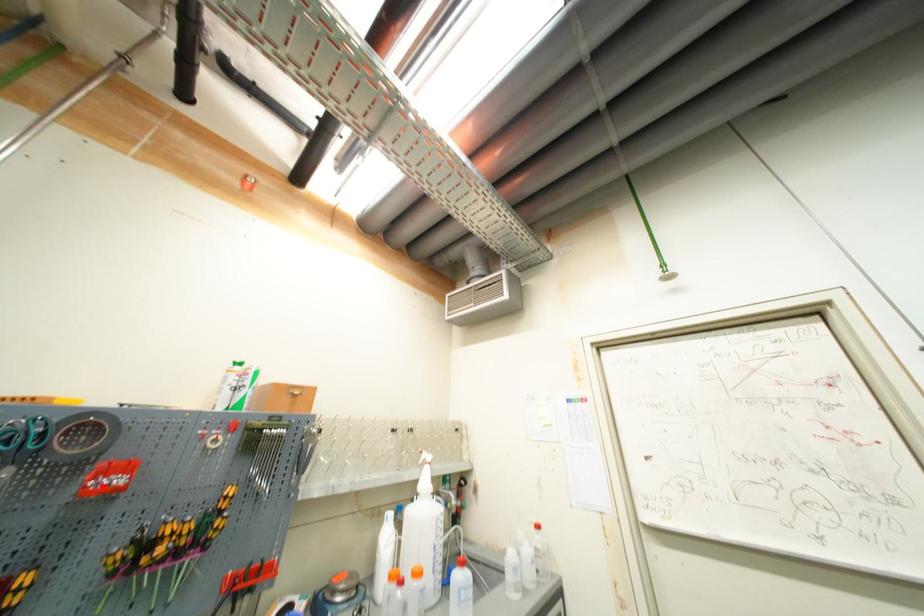
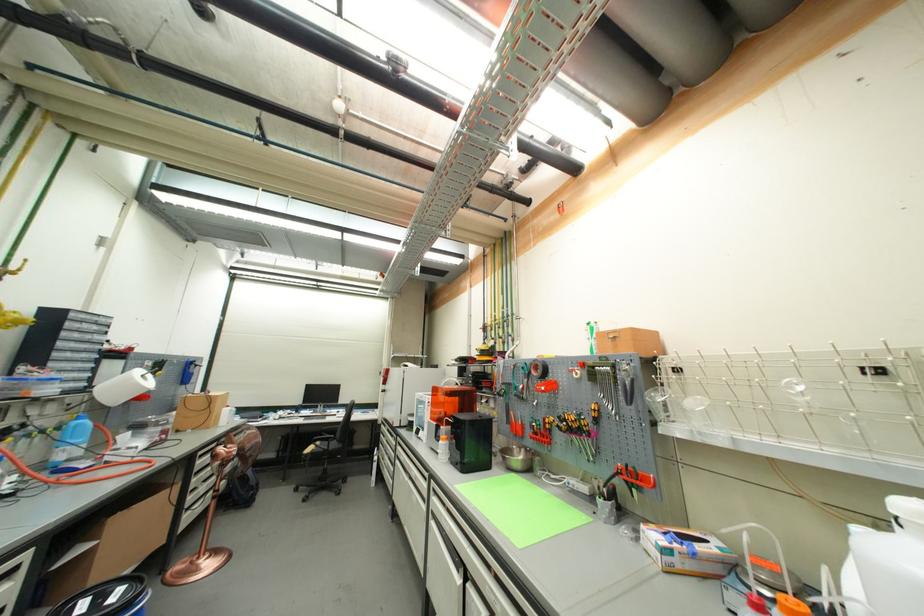
Question: I am providing you with two images of the same scene from different viewpoints. Image1 has a red point marked. In image2, the corresponding 3D location appears at what relative position? Reply with the corresponding letter.

Choices:
 (A) Closer
 (B) Farther

Answer: (B)